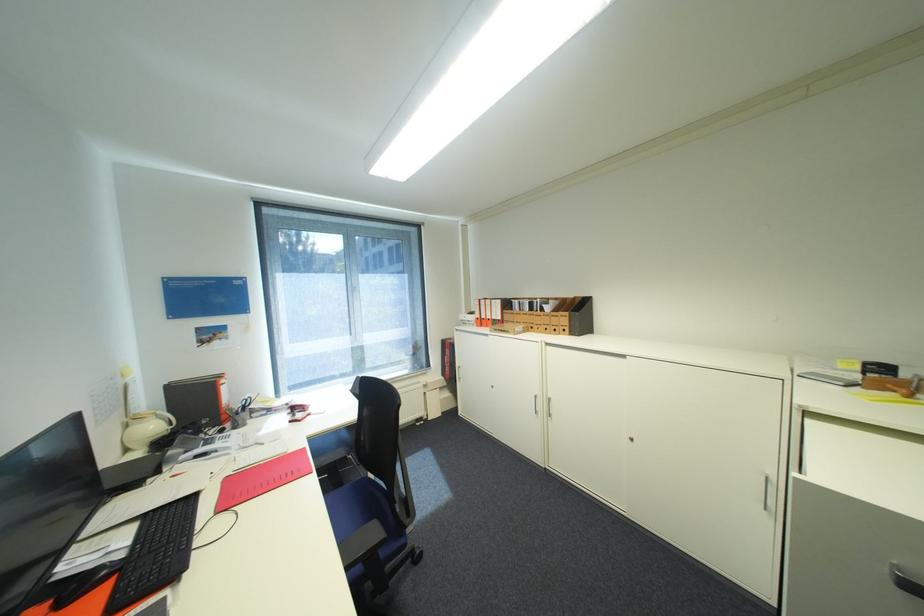
Locate an element on the screen. This screenshot has height=616, width=924. blue chair sitting surface is located at coordinates (348, 509).